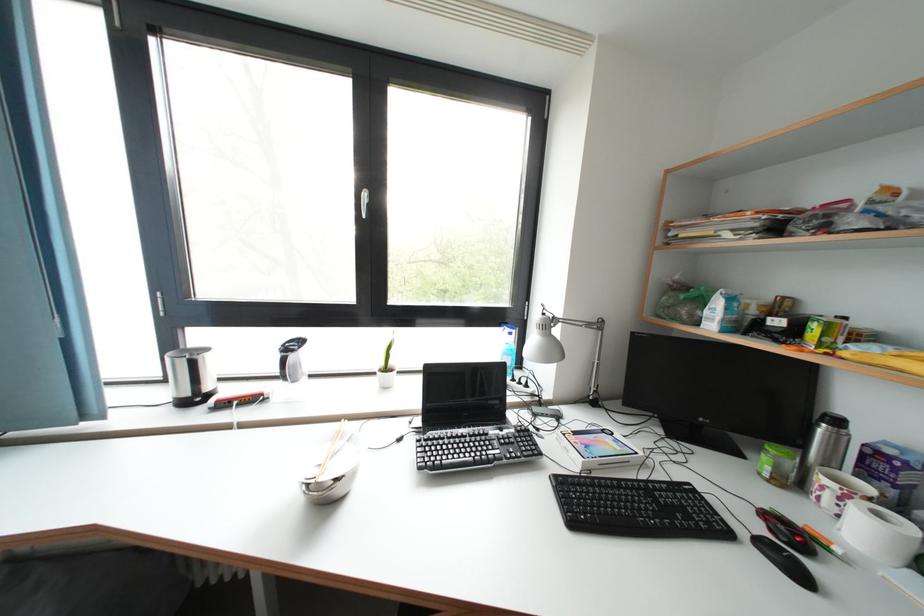
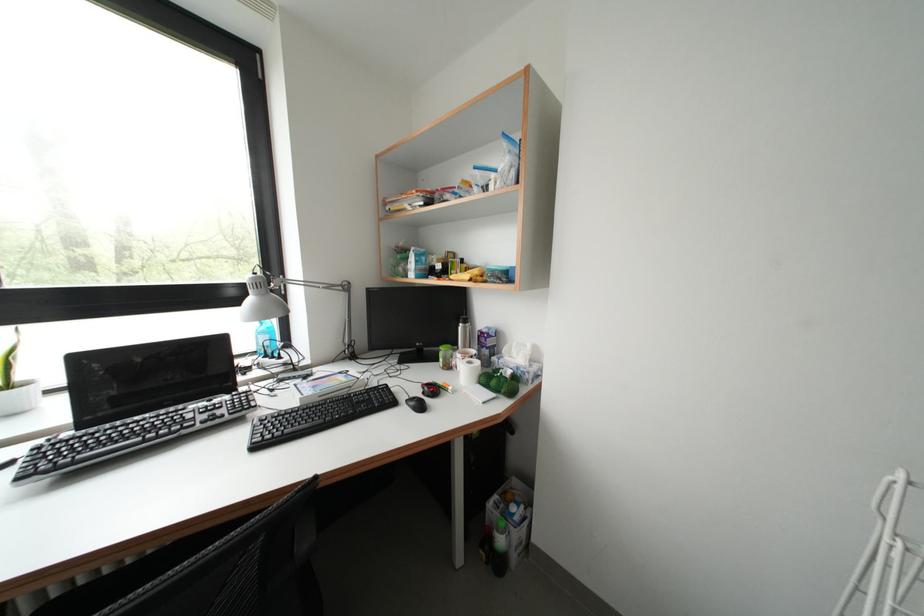
In the second image, find the point that corresponds to the point at 787,533 in the first image.

(432, 392)